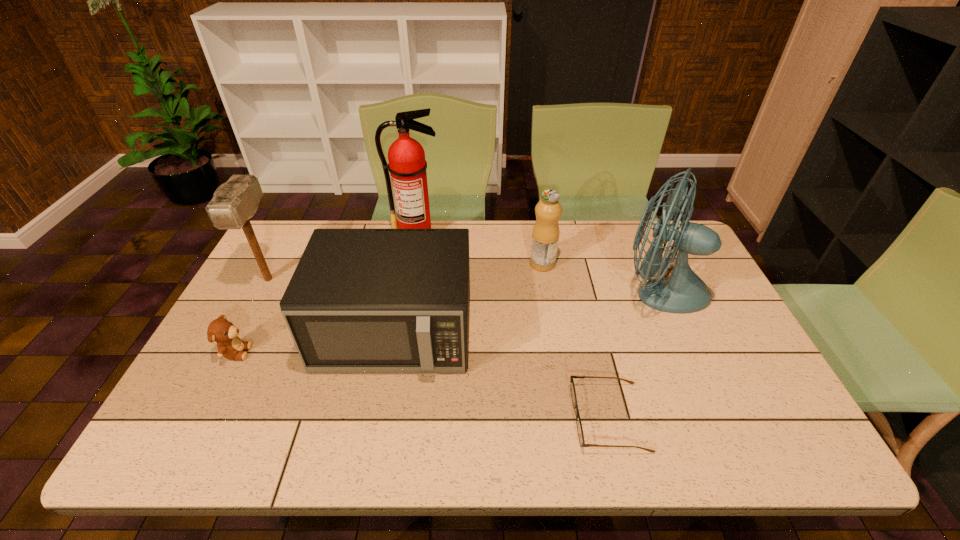
Identify the location of free space located 0.310m on the front-facing side of the nearest object. coord(440,417).

Locate an element on the screen. fire extinguisher located at the far edge is located at coordinates (407, 165).

Find the location of a particular element. The width and height of the screenshot is (960, 540). fan that is positioned at the far edge is located at coordinates (683, 292).

Identify the location of mallet at the far edge. The image size is (960, 540). (236, 201).

This screenshot has width=960, height=540. I want to click on fruit juice that is at the far edge, so click(545, 236).

Image resolution: width=960 pixels, height=540 pixels. Identify the location of object located in the near edge section of the desktop. (572, 387).

Identify the location of mallet that is positioned at the left edge. (236, 201).

Identify the location of teddy bear positioned at the left edge. (220, 330).

Find the location of a particular element. This screenshot has height=540, width=960. object situated at the right edge is located at coordinates (683, 292).

The width and height of the screenshot is (960, 540). Identify the location of object present at the far left corner. (236, 201).